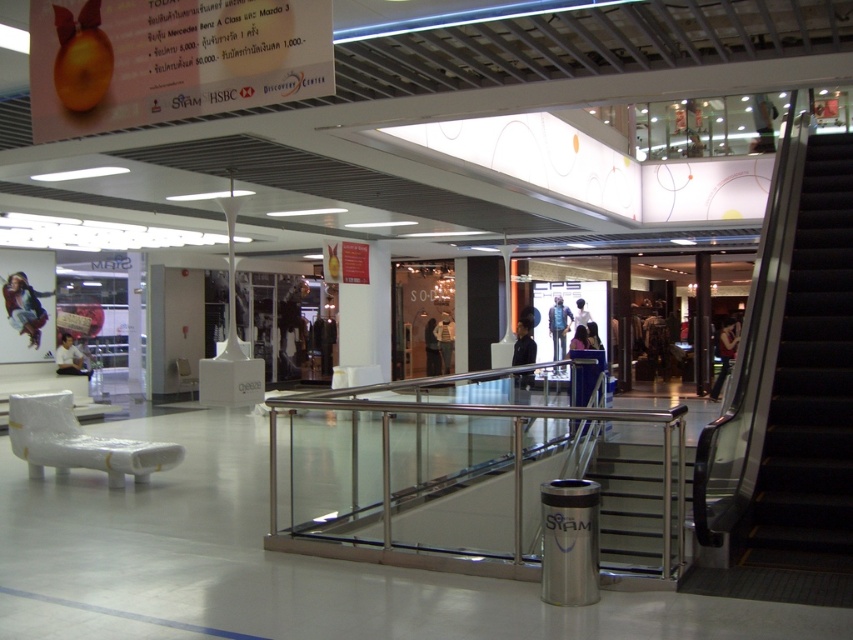
Between point (848, 332) and point (672, 568), which one is positioned in front?

Point (672, 568) is in front.

What do you see at coordinates (810, 385) in the screenshot? I see `black rubber stairs at right` at bounding box center [810, 385].

I want to click on black rubber stairs at right, so click(x=810, y=385).

Between dark blue jeans at center and white shirt at left, which one has less height?

white shirt at left is shorter.

Which of these two, dark blue jeans at center or white shirt at left, stands taller?

dark blue jeans at center is taller.

This screenshot has width=853, height=640. I want to click on dark blue jeans at center, so click(724, 352).

Find the location of a particular element. Image resolution: width=853 pixels, height=640 pixels. dark blue jeans at center is located at coordinates (724, 352).

Does denim jacket at center appear on the left side of white cotton shirt at center?

No, denim jacket at center is not to the left of white cotton shirt at center.

The height and width of the screenshot is (640, 853). What are the coordinates of `denim jacket at center` in the screenshot? It's located at (558, 326).